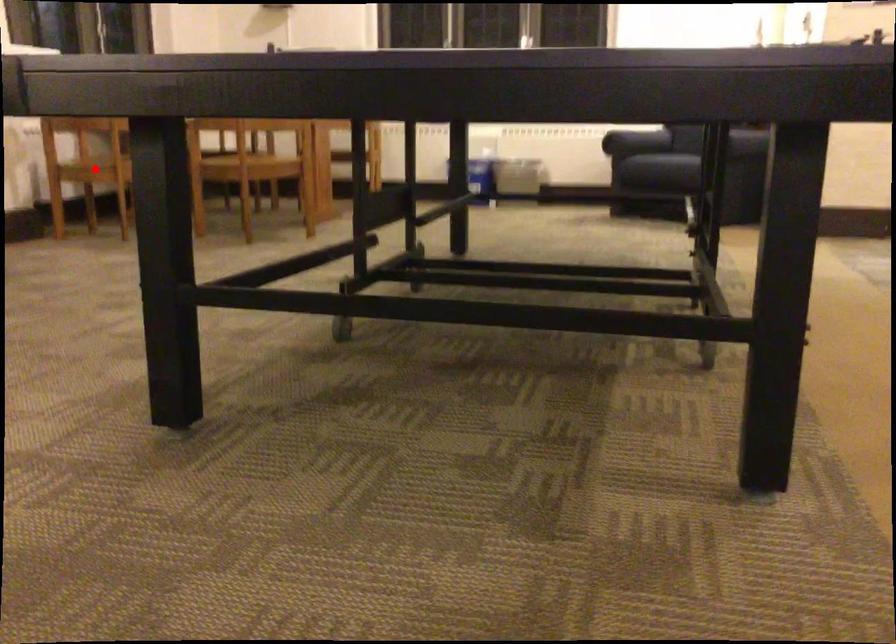
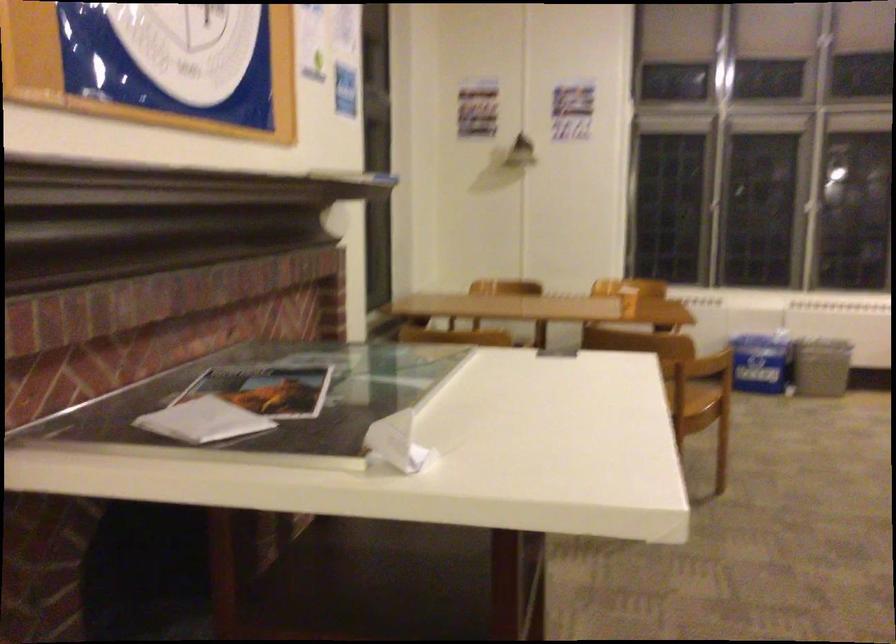
Question: I am providing you with two images of the same scene from different viewpoints. A red point is marked on the first image. Is the red point's position out of view in image 2?

Choices:
 (A) Yes
 (B) No

Answer: (A)